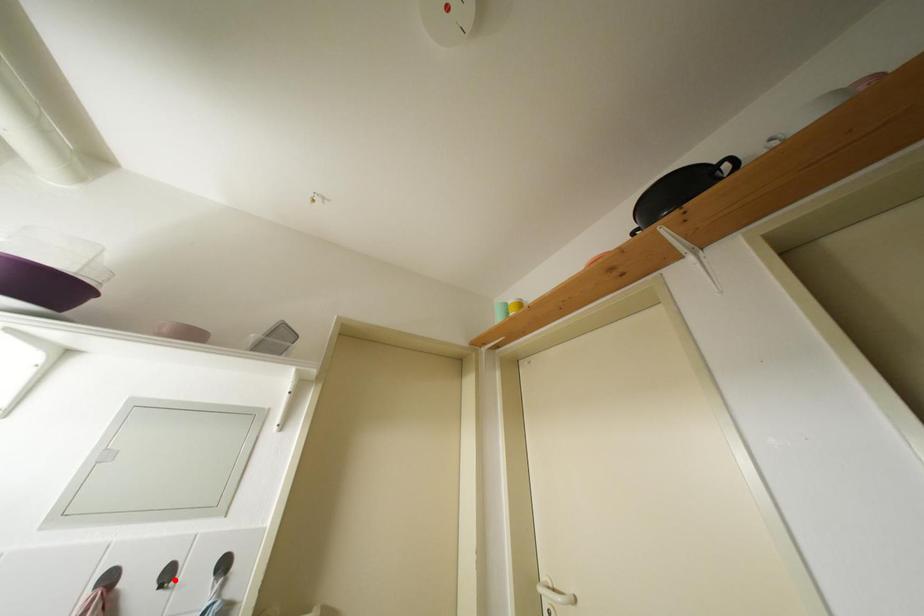
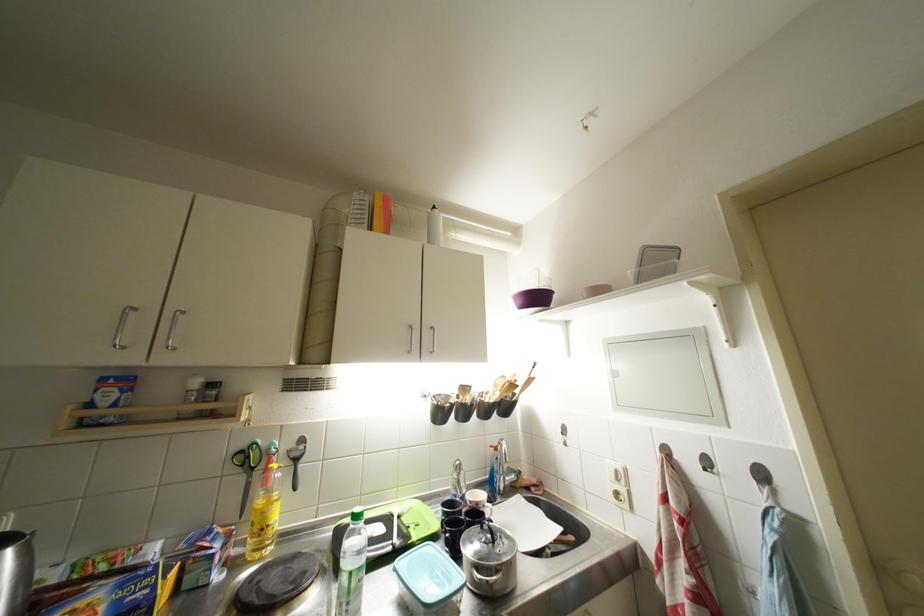
Where in the second image is the point corresponding to the highlighted location from the first image?

(714, 467)